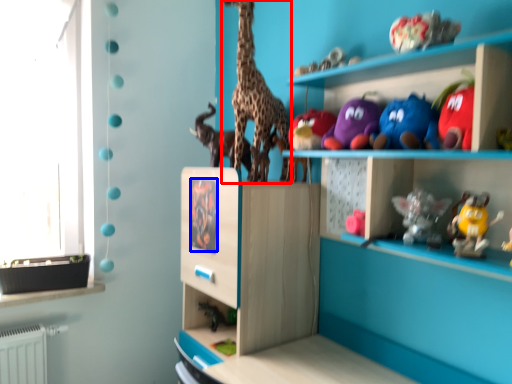
Question: Which point is further to the camera, giraffe (highlighted by a red box) or animal (highlighted by a blue box)?

Choices:
 (A) giraffe
 (B) animal

Answer: (B)